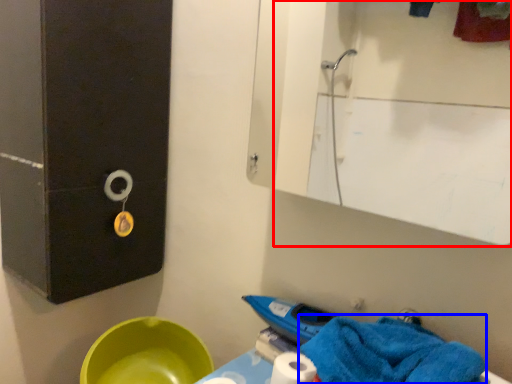
Question: Which object appears farthest to the camera in this image, mirror (highlighted by a red box) or bath towel (highlighted by a blue box)?

Choices:
 (A) mirror
 (B) bath towel

Answer: (A)